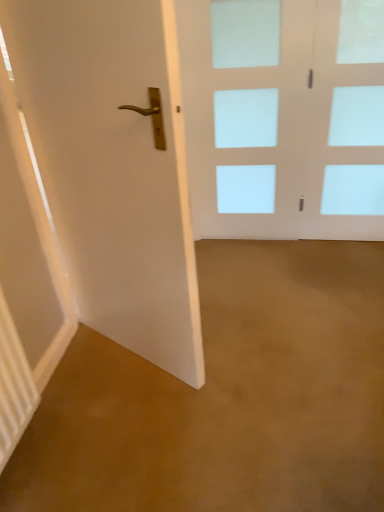
Image resolution: width=384 pixels, height=512 pixels. Identify the location of white glass door at center, which is the 1th door in right-to-left order. (284, 117).

Where is `white glass door at center, marked as the second door in a front-to-back arrangement`? The width and height of the screenshot is (384, 512). white glass door at center, marked as the second door in a front-to-back arrangement is located at coordinates (284, 117).

Can you confirm if white glass door at center, the second door positioned from the left, is bigger than clear glass door at upper right?

No, white glass door at center, the second door positioned from the left, is not bigger than clear glass door at upper right.

This screenshot has width=384, height=512. Find the location of `glass door below the white glass door at center, the second door positioned from the left (from a real-world perspective)`. glass door below the white glass door at center, the second door positioned from the left (from a real-world perspective) is located at coordinates (347, 123).

Who is shorter, white glass door at center, the 1th door positioned from the back, or clear glass door at upper right?

clear glass door at upper right is shorter.

In terms of height, does clear glass door at upper right look taller or shorter compared to white glass door at center, which is the 1th door in right-to-left order?

In the image, clear glass door at upper right appears to be shorter than white glass door at center, which is the 1th door in right-to-left order.

Find the location of a particular element. The width and height of the screenshot is (384, 512). the 1st door to the left when counting from the clear glass door at upper right is located at coordinates click(284, 117).

How different are the orientations of clear glass door at upper right and white glass door at center, marked as the second door in a front-to-back arrangement, in degrees?

The facing directions of clear glass door at upper right and white glass door at center, marked as the second door in a front-to-back arrangement, are 0.00846 degrees apart.

Is clear glass door at upper right next to white glass door at center, the second door positioned from the left, and touching it?

clear glass door at upper right is not next to white glass door at center, the second door positioned from the left, and they're not touching.

Considering their positions, is white glossy door at left, positioned as the 1th door in left-to-right order, located in front of or behind white glass door at center, which is the 1th door in right-to-left order?

In the image, white glossy door at left, positioned as the 1th door in left-to-right order, appears in front of white glass door at center, which is the 1th door in right-to-left order.

The height and width of the screenshot is (512, 384). Identify the location of door directly beneath the white glossy door at left, positioned as the 1th door in left-to-right order (from a real-world perspective). (284, 117).

Between white glossy door at left, which is the first door from front to back, and white glass door at center, the 1th door positioned from the back, which one has more height?

white glossy door at left, which is the first door from front to back, is taller.

Is clear glass door at upper right wider or thinner than white glossy door at left, which is the first door from front to back?

In the image, clear glass door at upper right appears to be more narrow than white glossy door at left, which is the first door from front to back.

Is clear glass door at upper right taller or shorter than white glossy door at left, which is the 2th door from right to left?

Considering their sizes, clear glass door at upper right has less height than white glossy door at left, which is the 2th door from right to left.

From a real-world perspective, relative to white glossy door at left, which is the second door from back to front, is clear glass door at upper right vertically above or below?

clear glass door at upper right is below white glossy door at left, which is the second door from back to front.

Is clear glass door at upper right to the left or to the right of white glossy door at left, which is the 2th door from right to left, in the image?

Clearly, clear glass door at upper right is on the right of white glossy door at left, which is the 2th door from right to left, in the image.

Is white glossy door at left, which is the second door from back to front, positioned beyond the bounds of clear glass door at upper right?

Absolutely, white glossy door at left, which is the second door from back to front, is external to clear glass door at upper right.

Looking at this image, who is smaller, white glossy door at left, which is the second door from back to front, or clear glass door at upper right?

clear glass door at upper right is smaller.

From their relative heights in the image, would you say white glossy door at left, which is the first door from front to back, is taller or shorter than clear glass door at upper right?

Clearly, white glossy door at left, which is the first door from front to back, is taller compared to clear glass door at upper right.

Considering the relative positions of white glass door at center, the second door positioned from the left, and white glossy door at left, positioned as the 1th door in left-to-right order, in the image provided, is white glass door at center, the second door positioned from the left, behind white glossy door at left, positioned as the 1th door in left-to-right order,?

Yes, white glass door at center, the second door positioned from the left, is further from the camera.

How much distance is there between white glass door at center, which is the 1th door in right-to-left order, and white glossy door at left, positioned as the 1th door in left-to-right order?

white glass door at center, which is the 1th door in right-to-left order, and white glossy door at left, positioned as the 1th door in left-to-right order, are 1.23 meters apart from each other.

From a real-world perspective, between white glass door at center, marked as the second door in a front-to-back arrangement, and white glossy door at left, which is the 2th door from right to left, who is vertically lower?

white glass door at center, marked as the second door in a front-to-back arrangement, is physically lower.

Based on the photo, is white glass door at center, the 1th door positioned from the back, aimed at white glossy door at left, which is the second door from back to front?

Yes, white glass door at center, the 1th door positioned from the back, is oriented towards white glossy door at left, which is the second door from back to front.

In order to click on glass door that is in front of the white glass door at center, which is the 1th door in right-to-left order in this screenshot , I will do `click(347, 123)`.

What are the coordinates of `glass door below the white glass door at center, the 1th door positioned from the back (from a real-world perspective)` in the screenshot? It's located at (347, 123).

When comparing their distances from white glossy door at left, which is the second door from back to front, does clear glass door at upper right or white glass door at center, the second door positioned from the left, seem closer?

white glass door at center, the second door positioned from the left, lies closer to white glossy door at left, which is the second door from back to front, than the other object.

From the image, which object appears to be nearer to white glass door at center, which is the 1th door in right-to-left order, clear glass door at upper right or white glossy door at left, positioned as the 1th door in left-to-right order?

clear glass door at upper right lies closer to white glass door at center, which is the 1th door in right-to-left order, than the other object.

Consider the image. Based on their spatial positions, is white glossy door at left, which is the second door from back to front, or clear glass door at upper right further from white glass door at center, which is the 1th door in right-to-left order?

The object further to white glass door at center, which is the 1th door in right-to-left order, is white glossy door at left, which is the second door from back to front.

From the image, which object appears to be farther from clear glass door at upper right, white glass door at center, which is the 1th door in right-to-left order, or white glossy door at left, which is the first door from front to back?

white glossy door at left, which is the first door from front to back, lies further to clear glass door at upper right than the other object.

From the image, which object appears to be farther from clear glass door at upper right, white glossy door at left, positioned as the 1th door in left-to-right order, or white glass door at center, the 1th door positioned from the back?

white glossy door at left, positioned as the 1th door in left-to-right order, is further to clear glass door at upper right.

Considering their positions, is white glass door at center, marked as the second door in a front-to-back arrangement, positioned closer to white glossy door at left, which is the 2th door from right to left, than clear glass door at upper right?

Among the two, white glass door at center, marked as the second door in a front-to-back arrangement, is located nearer to white glossy door at left, which is the 2th door from right to left.

Locate an element on the screen. This screenshot has height=512, width=384. door between white glossy door at left, positioned as the 1th door in left-to-right order, and clear glass door at upper right from left to right is located at coordinates (284, 117).